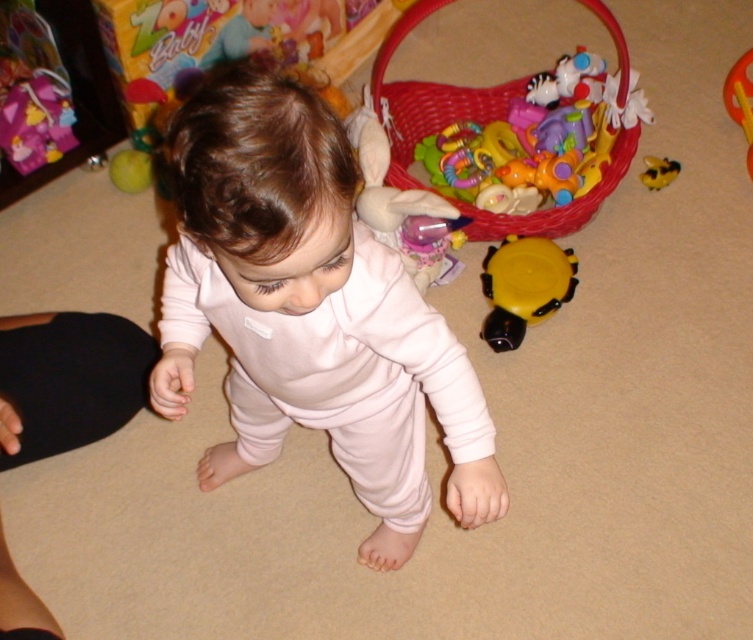
Question: Does yellow matte toy at center appear under yellow rubber duck at upper right?

Choices:
 (A) yes
 (B) no

Answer: (A)

Question: Based on their relative distances, which object is nearer to the yellow matte toy at center?

Choices:
 (A) yellow rubber duck at upper right
 (B) light pink fleece at center
 (C) yellow rubber bee at upper right

Answer: (C)

Question: Does light pink fleece at center appear over yellow rubber duck at upper right?

Choices:
 (A) no
 (B) yes

Answer: (A)

Question: Which point appears farthest from the camera in this image?

Choices:
 (A) (619, 61)
 (B) (654, 188)
 (C) (742, 112)

Answer: (C)

Question: Considering the real-world distances, which object is closest to the yellow rubber duck at upper right?

Choices:
 (A) yellow matte toy at center
 (B) yellow rubber bee at upper right

Answer: (B)

Question: Observing the image, what is the correct spatial positioning of light pink fleece at center in reference to yellow rubber bee at upper right?

Choices:
 (A) left
 (B) right

Answer: (A)